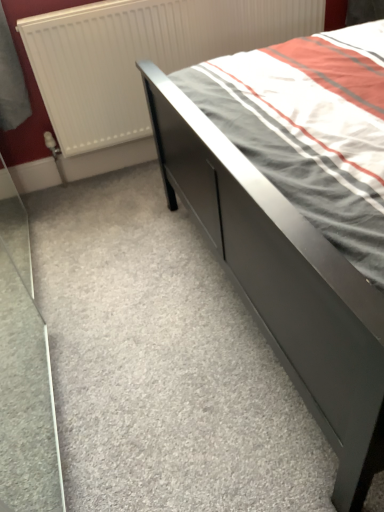
Question: Is white matte radiator at upper left spatially inside matte gray bed at center, or outside of it?

Choices:
 (A) inside
 (B) outside

Answer: (B)

Question: Is white matte radiator at upper left bigger or smaller than matte gray bed at center?

Choices:
 (A) big
 (B) small

Answer: (B)

Question: From a real-world perspective, is white matte radiator at upper left above or below matte gray bed at center?

Choices:
 (A) below
 (B) above

Answer: (B)

Question: From their relative heights in the image, would you say matte gray bed at center is taller or shorter than white matte radiator at upper left?

Choices:
 (A) tall
 (B) short

Answer: (B)

Question: Is matte gray bed at center bigger or smaller than white matte radiator at upper left?

Choices:
 (A) small
 (B) big

Answer: (B)

Question: Considering the positions of matte gray bed at center and white matte radiator at upper left in the image, is matte gray bed at center wider or thinner than white matte radiator at upper left?

Choices:
 (A) wide
 (B) thin

Answer: (A)

Question: From the image's perspective, is matte gray bed at center above or below white matte radiator at upper left?

Choices:
 (A) above
 (B) below

Answer: (B)